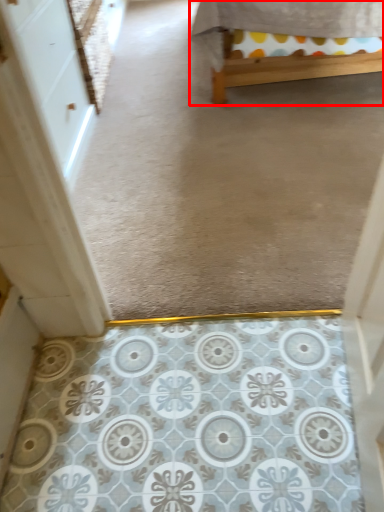
Question: From the image, what is the correct spatial relationship of furniture (annotated by the red box) in relation to screen door?

Choices:
 (A) left
 (B) right

Answer: (B)